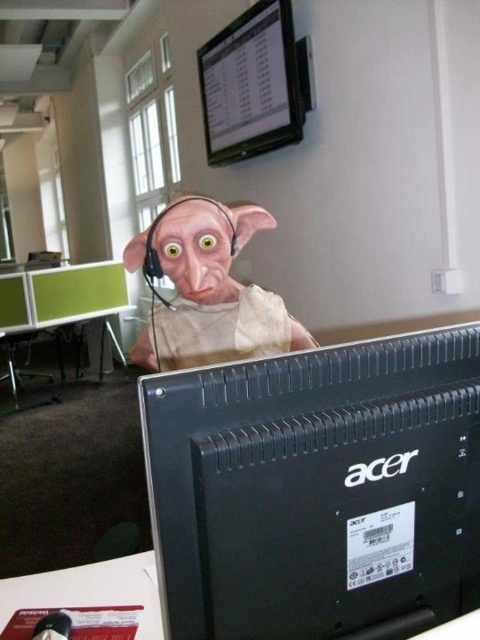
Between matte beige mask at center and matte plastic monitor at upper center, which one has more height?

With more height is matte plastic monitor at upper center.

Between matte beige mask at center and matte plastic monitor at upper center, which one has less height?

With less height is matte beige mask at center.

Who is more distant from viewer, (x=225, y=244) or (x=210, y=84)?

The point (x=210, y=84) is more distant.

Find the location of a particular element. matte beige mask at center is located at coordinates (207, 289).

Can you confirm if matte plastic monitor at upper center is bigger than green plastic desk at center?

Correct, matte plastic monitor at upper center is larger in size than green plastic desk at center.

Can you confirm if matte plastic monitor at upper center is thinner than green plastic desk at center?

Yes, matte plastic monitor at upper center is thinner than green plastic desk at center.

At what (x,y) coordinates should I click in order to perform the action: click on matte plastic monitor at upper center. Please return your answer as a coordinate pair (x, y). Image resolution: width=480 pixels, height=640 pixels. Looking at the image, I should click on (251, 84).

Does matte beige mask at center have a greater width compared to green plastic desk at center?

No.

Between point (275, 305) and point (121, 278), which one is positioned in front?

Point (275, 305) is in front.

Is point (175, 241) less distant than point (31, 280)?

Yes, it is in front of point (31, 280).

The height and width of the screenshot is (640, 480). What are the coordinates of `matte beige mask at center` in the screenshot? It's located at (207, 289).